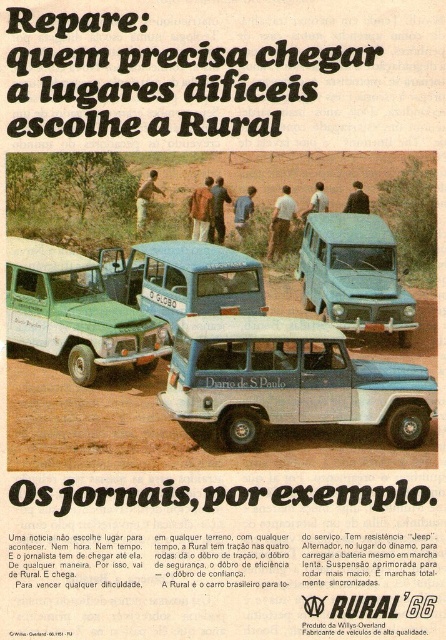
Question: Is blue fabric shirt at center positioned behind dark brown leather jacket at center?

Choices:
 (A) no
 (B) yes

Answer: (B)

Question: Which object appears closest to the camera in this image?

Choices:
 (A) light brown shirt at center
 (B) blue fabric shirt at center
 (C) light brown leather jacket at center

Answer: (A)

Question: Can you confirm if green matte truck at center-left is thinner than blue matte van at center?

Choices:
 (A) no
 (B) yes

Answer: (B)

Question: From the image, what is the correct spatial relationship of light brown shirt at center in relation to light brown leather jacket at center?

Choices:
 (A) below
 (B) above

Answer: (A)

Question: Estimate the real-world distances between objects in this image. Which object is farther from the light blue shirt at center?

Choices:
 (A) blue fabric shirt at center
 (B) white matte station wagon at center

Answer: (B)

Question: Which point is farther to the camera?

Choices:
 (A) light blue shirt at center
 (B) brown leather jacket at center
 (C) blue fabric jacket at center
 (D) matte blue truck at center

Answer: (B)